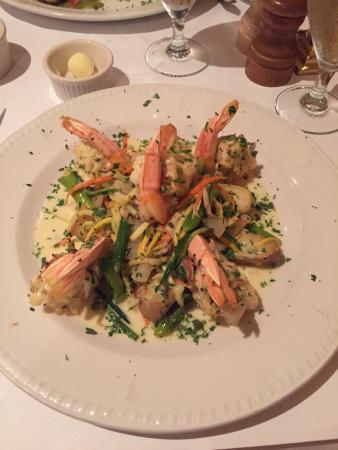
Identify the location of salt grinder. The image size is (338, 450). (251, 20).